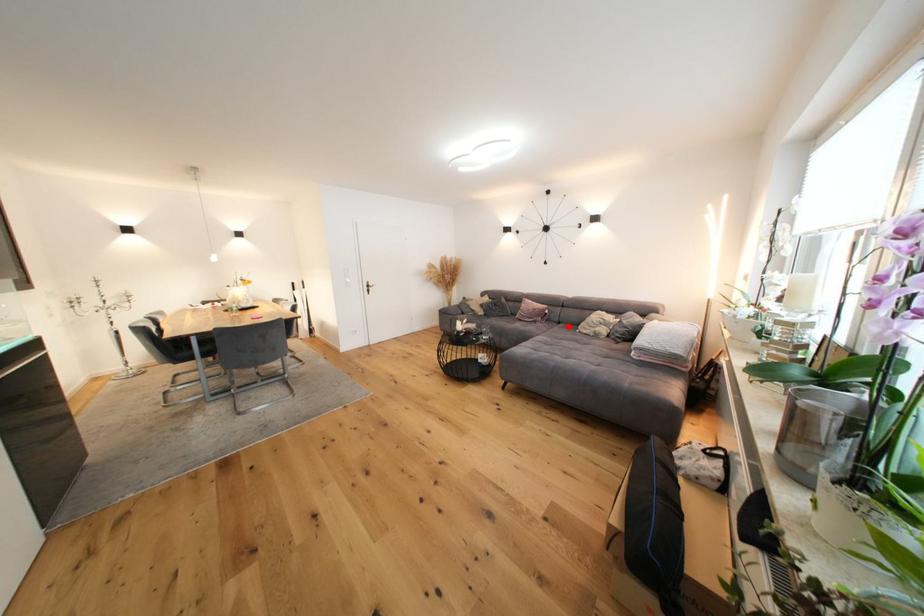
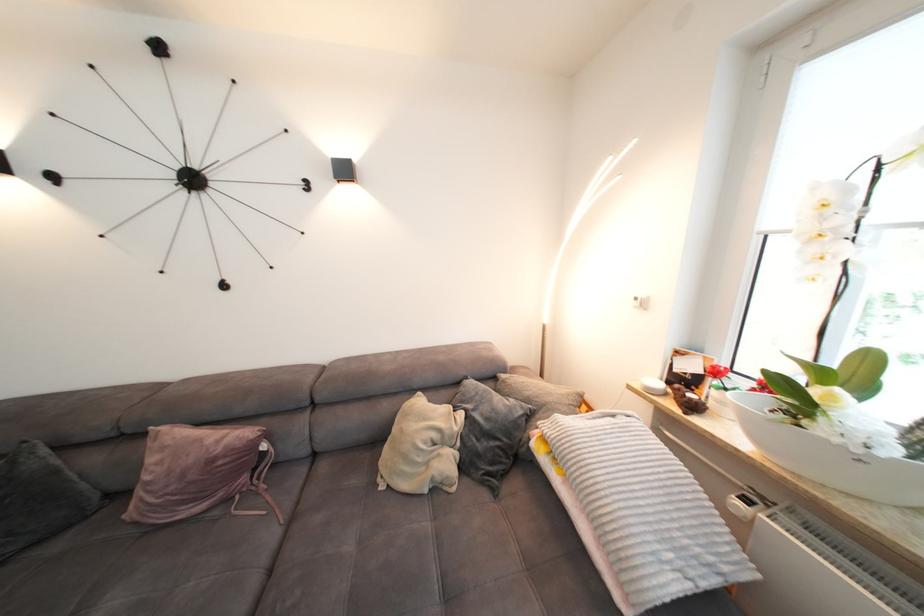
Question: I am providing you with two images of the same scene from different viewpoints. A red point is shown in image1. For the corresponding object point in image2, is it positioned nearer or farther from the camera?

Choices:
 (A) Nearer
 (B) Farther

Answer: (B)